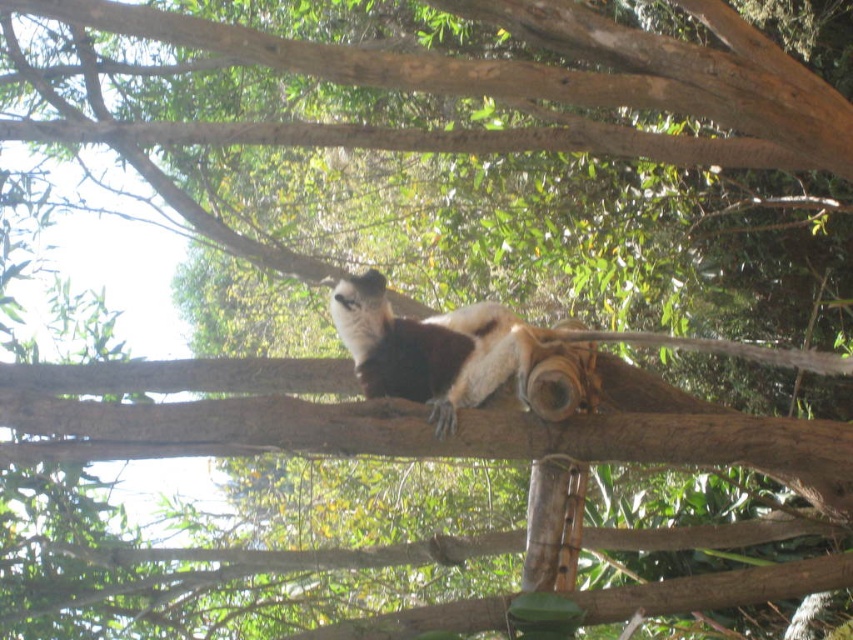
Which is behind, point (764, 56) or point (364, 340)?

Point (364, 340)

What do you see at coordinates (543, 83) in the screenshot? I see `brown rough tree branch at upper center` at bounding box center [543, 83].

The image size is (853, 640). Describe the element at coordinates (543, 83) in the screenshot. I see `brown rough tree branch at upper center` at that location.

Find the location of a particular element. brown rough tree branch at upper center is located at coordinates (543, 83).